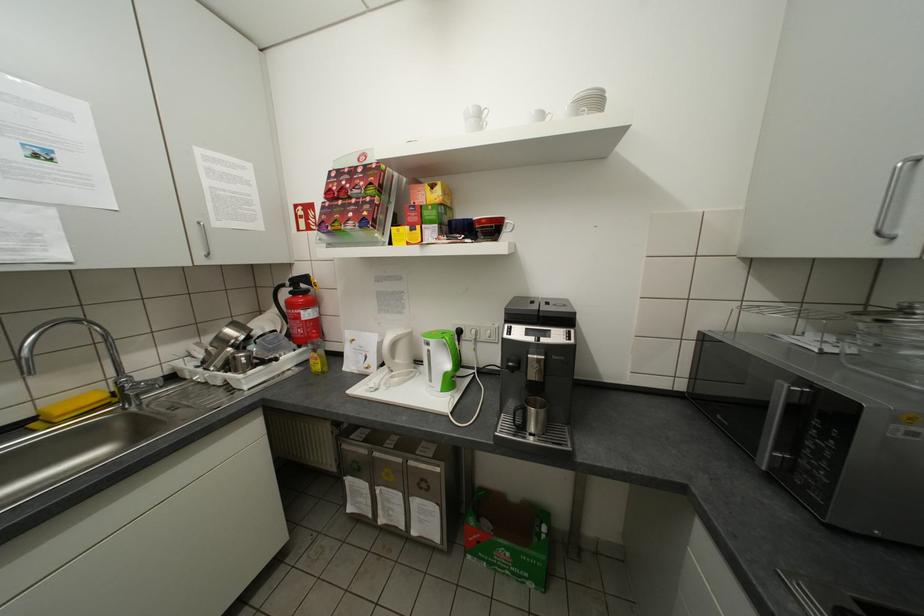
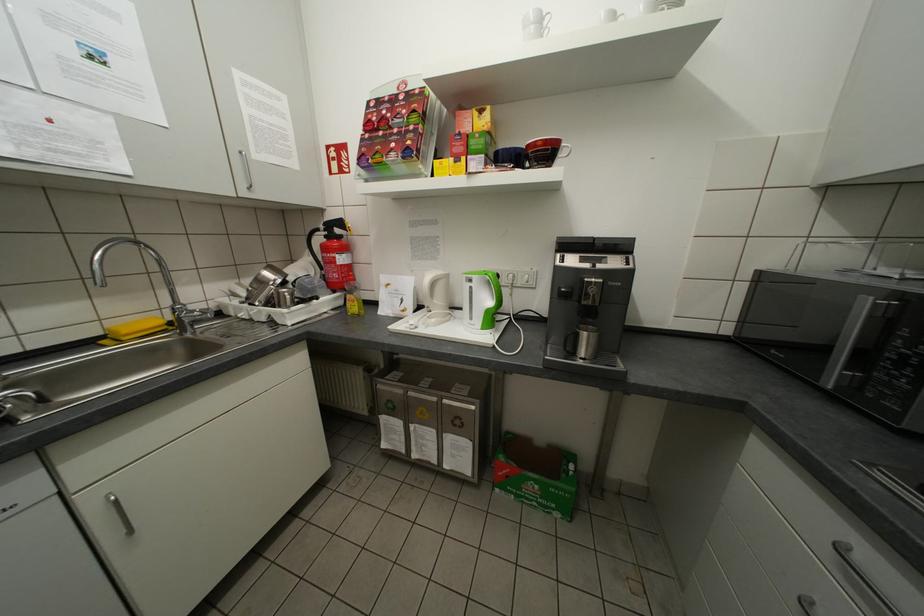
Question: Based on the continuous images, in which direction is the camera rotating? Reply with the corresponding letter.

Choices:
 (A) Left
 (B) Right
 (C) Up
 (D) Down

Answer: (D)